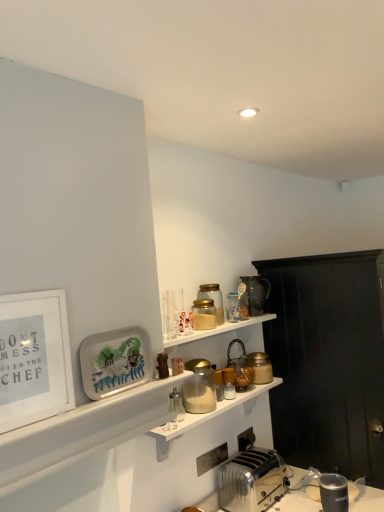
Question: Is metallic silver toaster at lower right, the third appliance in the front-to-back sequence, in contact with translucent glass jar at upper center, which is the sixth appliance in back-to-front order?

Choices:
 (A) yes
 (B) no

Answer: (B)

Question: From a real-world perspective, is metallic silver toaster at lower right, the 8th appliance positioned from the back, positioned over translucent glass jar at upper center, which is the sixth appliance in back-to-front order, based on gravity?

Choices:
 (A) yes
 (B) no

Answer: (B)

Question: Does metallic silver toaster at lower right, the 8th appliance positioned from the back, have a greater width compared to translucent glass jar at upper center, which ranks as the 5th appliance in front-to-back order?

Choices:
 (A) yes
 (B) no

Answer: (B)

Question: Considering the relative sizes of metallic silver toaster at lower right, the third appliance in the front-to-back sequence, and translucent glass jar at upper center, which ranks as the 5th appliance in front-to-back order, in the image provided, is metallic silver toaster at lower right, the third appliance in the front-to-back sequence, shorter than translucent glass jar at upper center, which ranks as the 5th appliance in front-to-back order,?

Choices:
 (A) yes
 (B) no

Answer: (B)

Question: Considering the relative positions of metallic silver toaster at lower right, the 8th appliance positioned from the back, and translucent glass jar at upper center, which is the sixth appliance in back-to-front order, in the image provided, is metallic silver toaster at lower right, the 8th appliance positioned from the back, to the left of translucent glass jar at upper center, which is the sixth appliance in back-to-front order, from the viewer's perspective?

Choices:
 (A) no
 (B) yes

Answer: (A)

Question: Looking at the image, does silver metallic toaster at lower center seem bigger or smaller compared to matte plastic tray at lower left, placed as the first picture frame when sorted from right to left?

Choices:
 (A) small
 (B) big

Answer: (B)

Question: In the image, is silver metallic toaster at lower center positioned in front of or behind matte plastic tray at lower left, placed as the first picture frame when sorted from right to left?

Choices:
 (A) behind
 (B) front

Answer: (A)

Question: Does point (261, 450) appear closer or farther from the camera than point (142, 359)?

Choices:
 (A) closer
 (B) farther

Answer: (B)

Question: From a real-world perspective, is silver metallic toaster at lower center physically located above or below matte plastic tray at lower left, the second picture frame in the front-to-back sequence?

Choices:
 (A) below
 (B) above

Answer: (A)

Question: Relative to clear glass jar at upper center, the third appliance in the back-to-front sequence, is black wood cabinet at right in front or behind?

Choices:
 (A) front
 (B) behind

Answer: (A)

Question: In the image, is black wood cabinet at right on the left side or the right side of clear glass jar at upper center, which is the eighth appliance from front to back?

Choices:
 (A) left
 (B) right

Answer: (B)

Question: Is black wood cabinet at right inside the boundaries of clear glass jar at upper center, the third appliance in the back-to-front sequence, or outside?

Choices:
 (A) inside
 (B) outside

Answer: (B)

Question: In terms of size, does black wood cabinet at right appear bigger or smaller than clear glass jar at upper center, which is the eighth appliance from front to back?

Choices:
 (A) big
 (B) small

Answer: (A)

Question: From a real-world perspective, is black wood cabinet at right positioned above or below matte gold jar at upper right, the second appliance from the back?

Choices:
 (A) below
 (B) above

Answer: (A)

Question: Considering the positions of point (296, 259) and point (268, 360), is point (296, 259) closer or farther from the camera than point (268, 360)?

Choices:
 (A) farther
 (B) closer

Answer: (A)